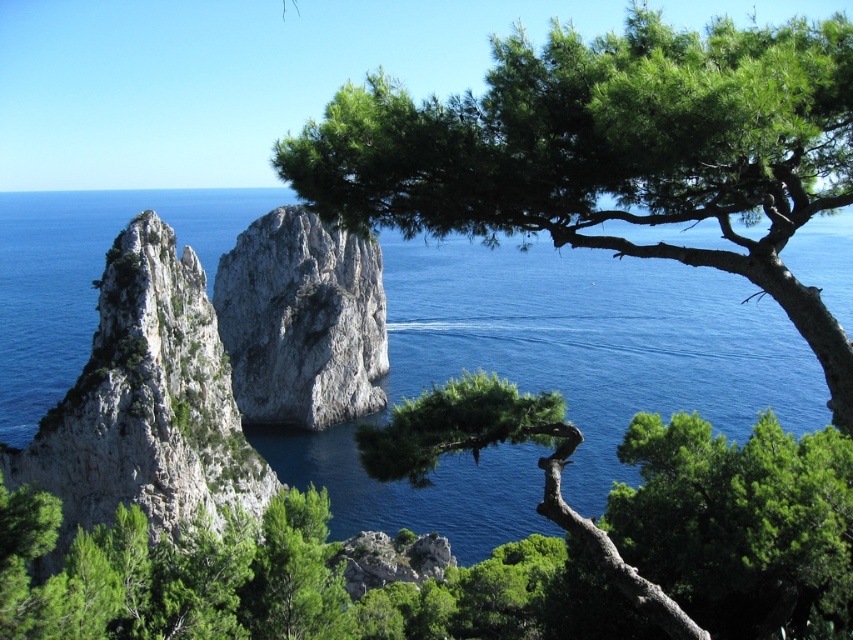
You are standing at the center of the image and want to reach the white rocky cliff at left. Which direction should you move to get there?

You should move to the left to reach the white rocky cliff at left since its 2D location is at point [146,403], which is on the left side of the image.